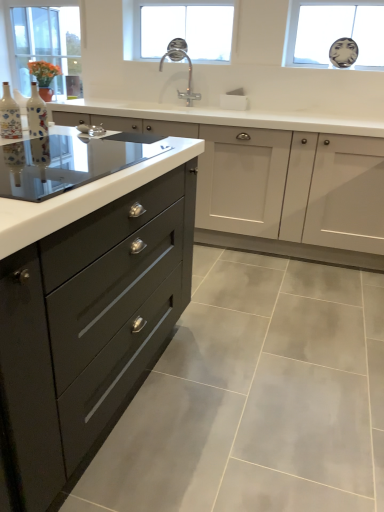
Question: From a real-world perspective, is decorative ceramic vase at left, the 1th bottle from the right, positioned above or below transparent glass mirror at upper right, which appears as the 1th window when viewed from the right?

Choices:
 (A) above
 (B) below

Answer: (B)

Question: Considering their positions, is decorative ceramic vase at left, which is the second bottle in left-to-right order, located in front of or behind transparent glass mirror at upper right, acting as the 3th window starting from the left?

Choices:
 (A) behind
 (B) front

Answer: (B)

Question: Which object is positioned closest to the black glass cooktop at left?

Choices:
 (A) clear glass window at upper left, which appears as the first window when viewed from the left
 (B) decorative ceramic vase at left, which is the second bottle in left-to-right order
 (C) transparent glass mirror at upper right, which appears as the 1th window when viewed from the right
 (D) matte black drawer at left
 (E) clear glass faucet at upper center, the second window viewed from the left

Answer: (B)

Question: Which of these objects is positioned closest to the clear glass faucet at upper center, the second window viewed from the left?

Choices:
 (A) polished chrome faucet at center
 (B) clear glass window at upper left, which appears as the first window when viewed from the left
 (C) transparent glass mirror at upper right, which appears as the 1th window when viewed from the right
 (D) matte black drawer at left
 (E) matte ceramic vase at left, which appears as the 1th bottle when viewed from the left

Answer: (A)